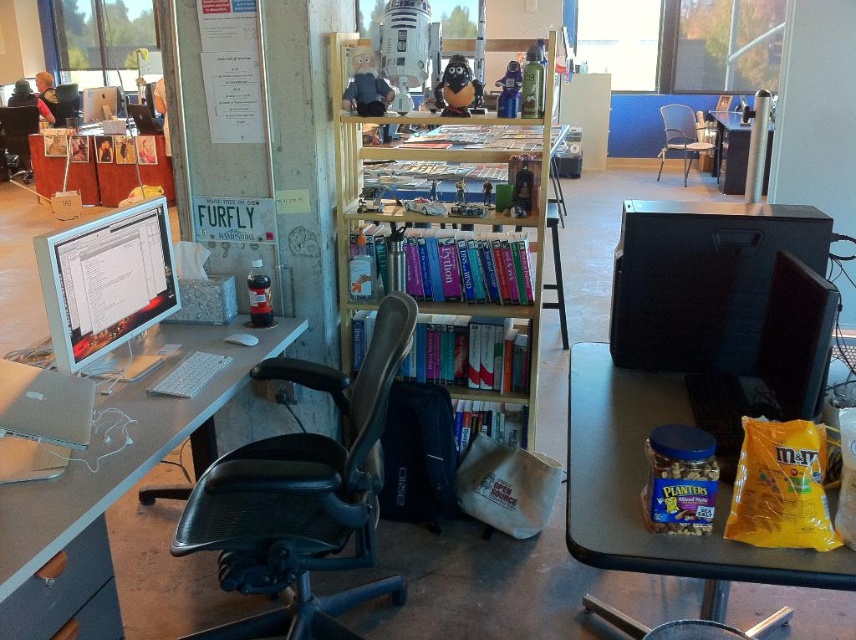
You are organizing a small event and need to place a rectangular tablecloth that is 1.2 meters wide on either the black leather swivel chair at center or the white paperboard at upper left. Based on their sizes, which object can the tablecloth fit over without hanging off the edges?

The black leather swivel chair at center has a larger width than the white paperboard at upper left. Therefore, the tablecloth would fit better on the black leather swivel chair at center since its width is sufficient to accommodate the 1.2 meter tablecloth without overhanging.

You are organizing an event and need to place a 18 inch wide decorative item on the desk. The satin silver monitor at left and metallic silver chair at center are already there. Which object can you place the item next to without exceeding the desk space?

The metallic silver chair at center has a wider width than the satin silver monitor at left, so placing the 18 inch item next to the metallic silver chair at center would be more likely to fit without exceeding desk space.

You are standing at the origin point of the workspace coordinate system. You need to move towards the black leather swivel chair at center. What direction should you move in?

Since the black leather swivel chair at center is located at point (301, 497) in the 2D coordinate system, you should move towards the positive x and positive y directions to reach it.